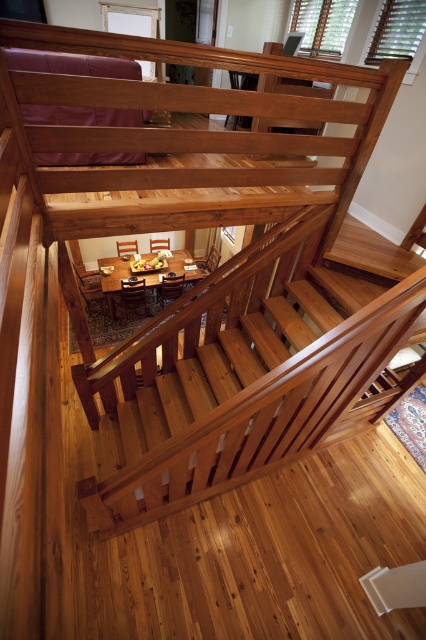
Does point (241, 444) come closer to viewer compared to point (172, 269)?

That is True.

Between natural wood stairs at center and brown wooden dining table at center, which one appears on the right side from the viewer's perspective?

natural wood stairs at center

Describe the element at coordinates (256, 413) in the screenshot. I see `natural wood stairs at center` at that location.

Locate an element on the screen. The image size is (426, 640). natural wood stairs at center is located at coordinates (256, 413).